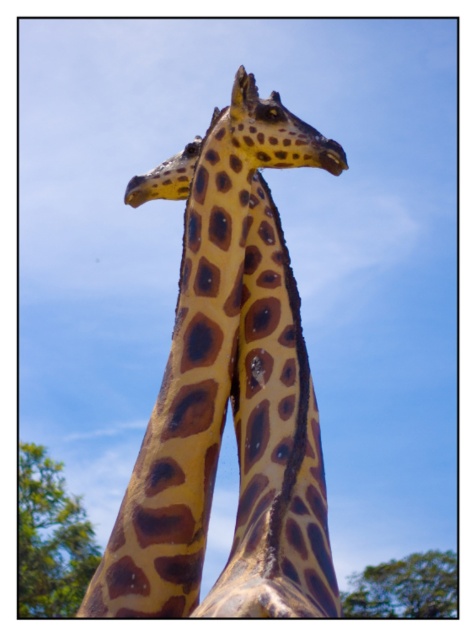
Question: Can you confirm if spotted fur giraffe at center is positioned to the left of green leafy tree at lower left?

Choices:
 (A) no
 (B) yes

Answer: (A)

Question: Which object is closer to the camera taking this photo?

Choices:
 (A) spotted fur giraffe at center
 (B) green leafy tree at lower right
 (C) spotted fur giraffe head at center

Answer: (A)

Question: Does green leafy tree at lower left come behind spotted fur giraffe head at center?

Choices:
 (A) yes
 (B) no

Answer: (A)

Question: Is spotted fur giraffe at center to the right of spotted fur giraffe head at center from the viewer's perspective?

Choices:
 (A) no
 (B) yes

Answer: (A)

Question: Which point is farther from the camera taking this photo?

Choices:
 (A) (72, 506)
 (B) (158, 532)
 (C) (358, 612)

Answer: (C)

Question: Which point is farther from the camera taking this photo?

Choices:
 (A) (357, 579)
 (B) (269, 108)
 (C) (89, 541)
 (D) (281, 500)

Answer: (A)